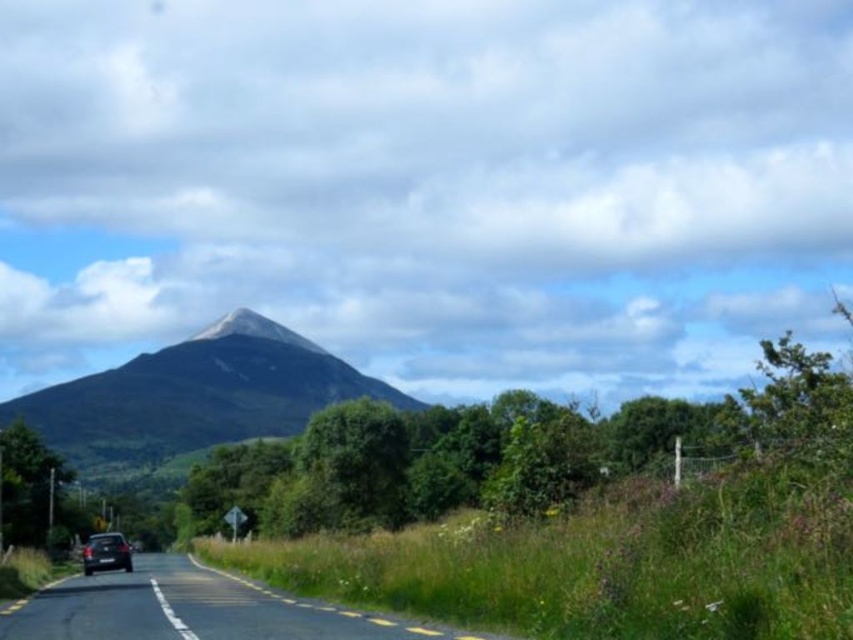
You are a photographer planning to take a photo of the shiny black car at lower left and the green grassy mountain at center. Which object should you focus on first if you want to capture both in sharp focus?

The green grassy mountain at center is much taller than the shiny black car at lower left, so you should focus on the green grassy mountain at center first to ensure both are in sharp focus.

Based on the scene description, where is the green grassy mountain at center located in terms of its 2D coordinates?

The green grassy mountain at center is located at the 2D coordinates of point (x=195, y=396).